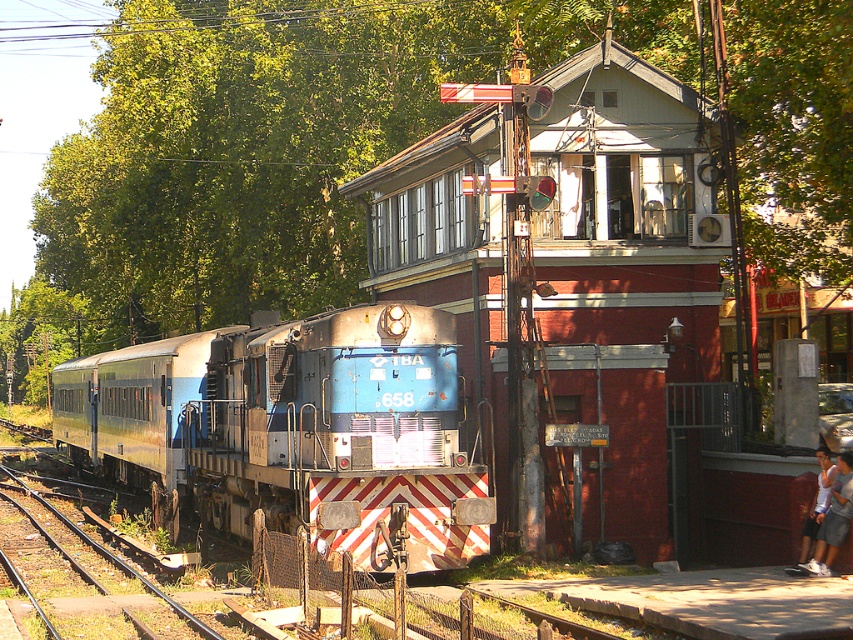
You are standing at the center of the railway crossing and notice the rusty metal train at left. Where is the rusty metal train relative to your position?

The rusty metal train at left is located at point 0.673 on the x axis and 0.346 on the y axis relative to your position at the center of the railway crossing.

You are a photographer trying to capture the rusty metal train at left and the white cotton shirt at lower right in the same frame. Which object should you focus on first if you want to ensure both are in focus without adjusting your camera settings?

Since the rusty metal train at left is wider than the white cotton shirt at lower right, you should focus on the rusty metal train at left first to ensure both are in focus without adjusting your camera settings.